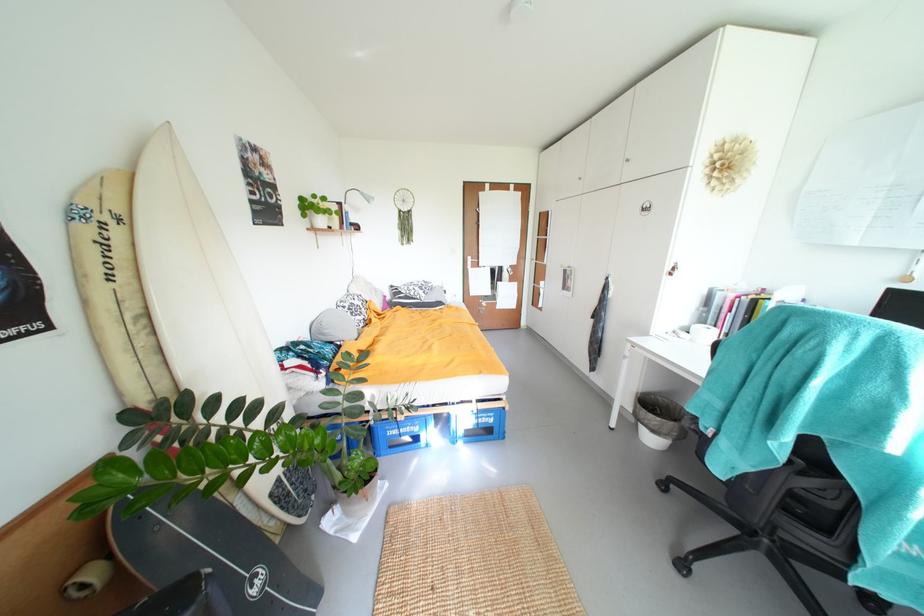
The height and width of the screenshot is (616, 924). I want to click on door handle, so click(x=473, y=269).